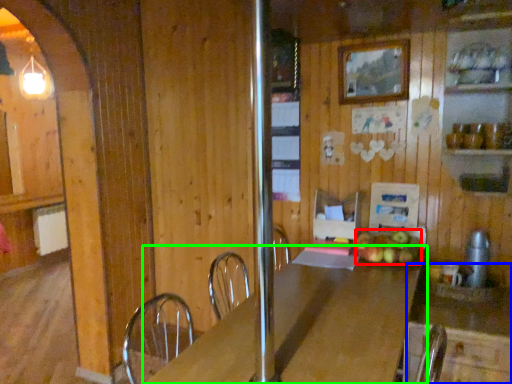
Question: Based on their relative distances, which object is nearer to apple (highlighted by a red box)? Choose from counter (highlighted by a blue box) and table (highlighted by a green box).

Choices:
 (A) counter
 (B) table

Answer: (A)